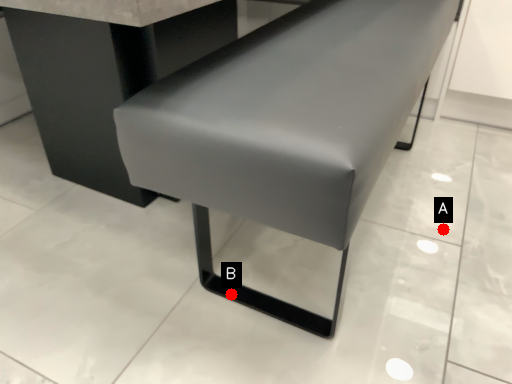
Question: Two points are circled on the image, labeled by A and B beside each circle. Which point is closer to the camera?

Choices:
 (A) A is closer
 (B) B is closer

Answer: (B)